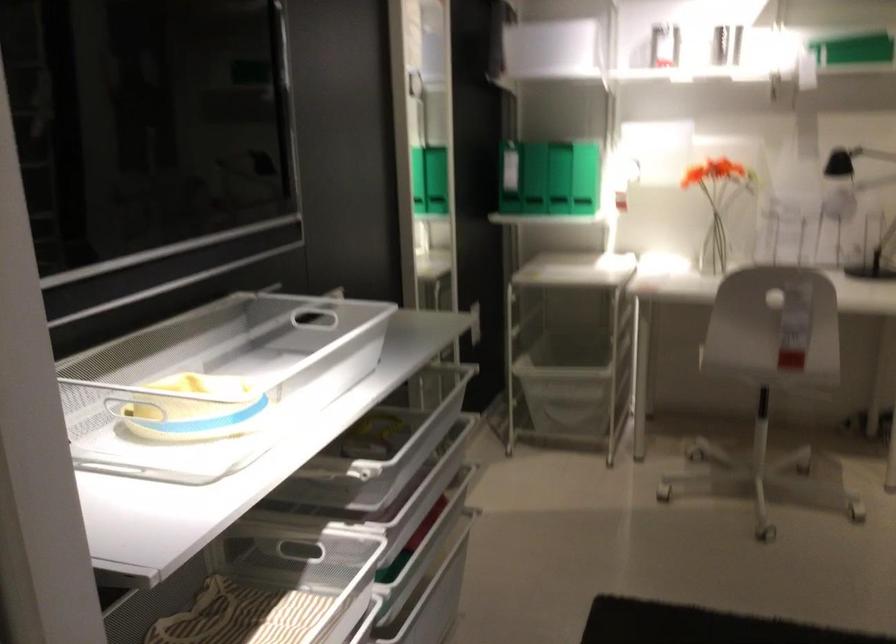
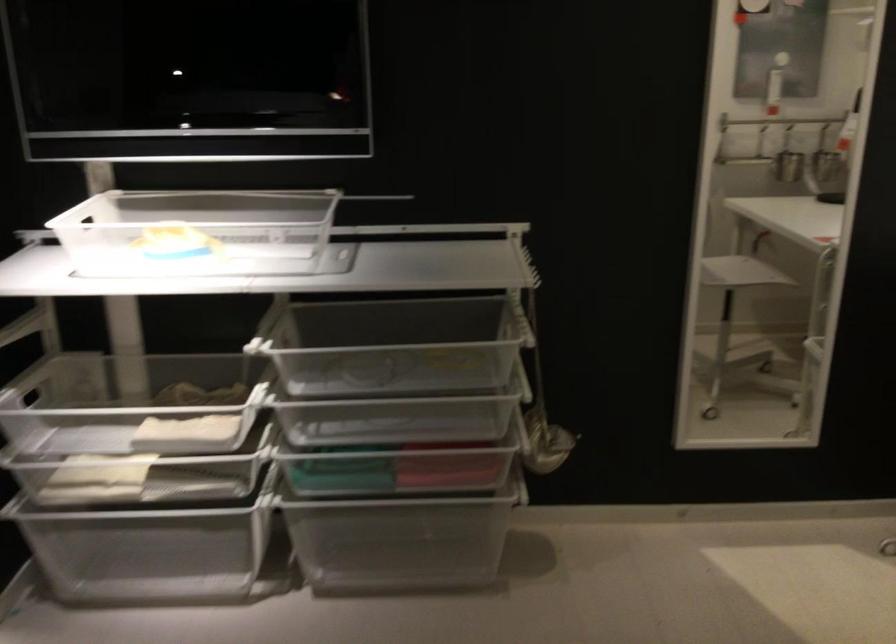
Where in the second image is the point corresponding to (x=209, y=341) from the first image?

(197, 232)